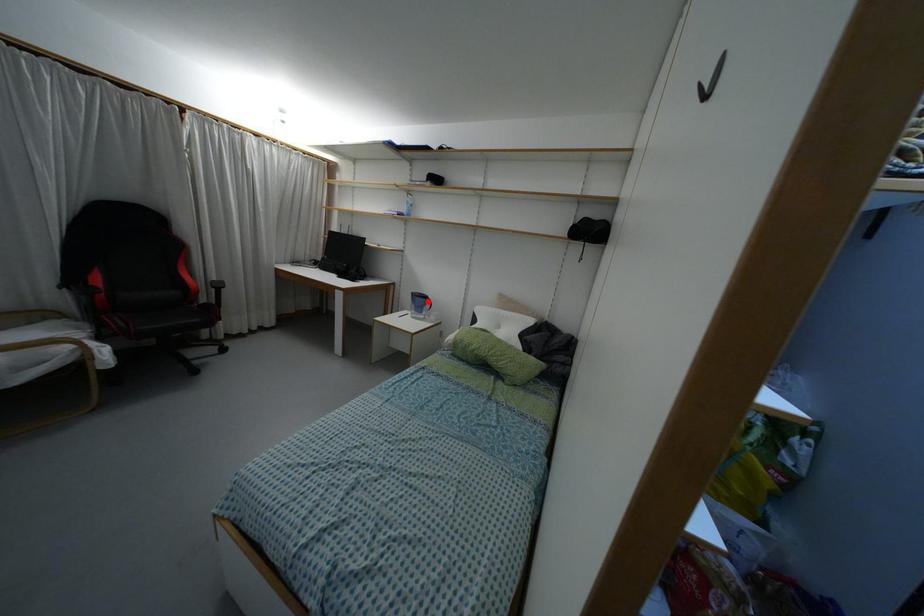
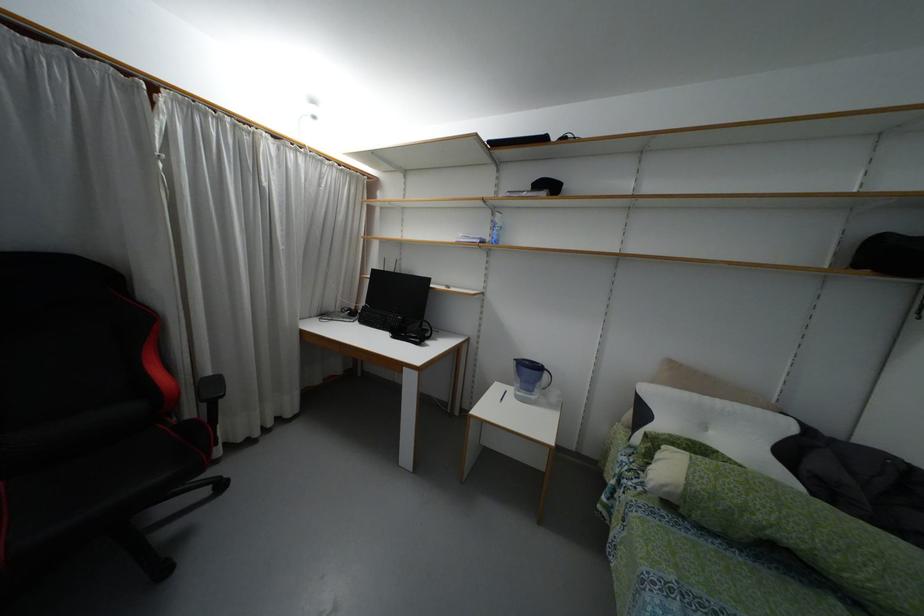
Where in the second image is the point corresponding to the highlighted location from the first image?

(544, 375)